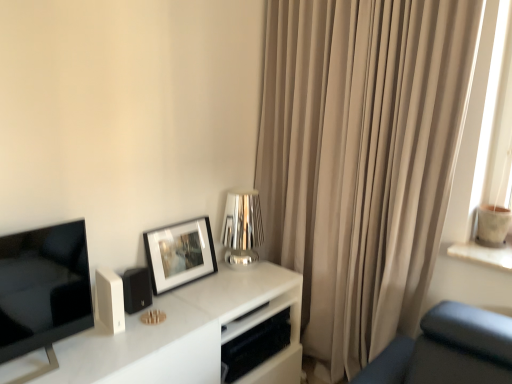
Image resolution: width=512 pixels, height=384 pixels. Identify the location of spots to the right of matte black speaker at lower left. (178, 313).